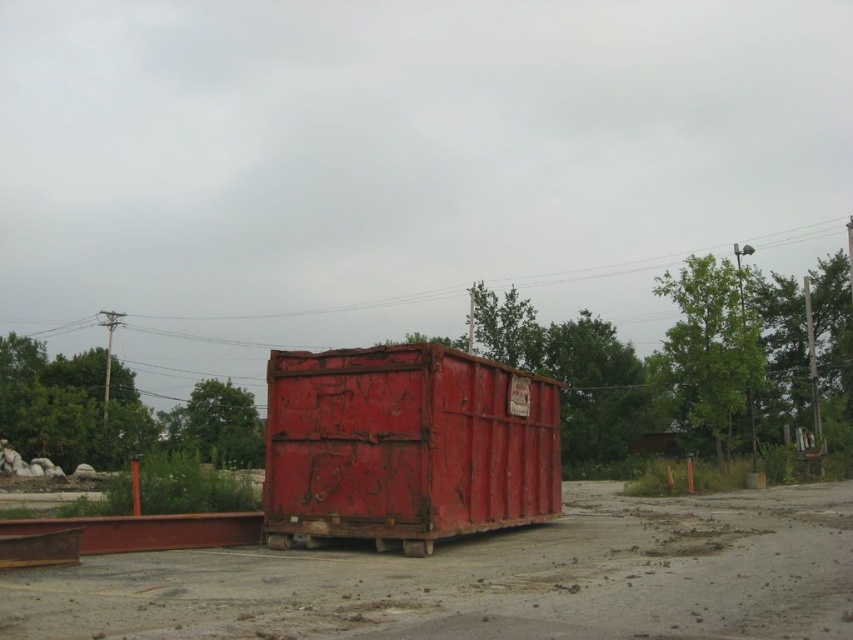
Question: Does dull concrete dirt track at center come in front of rusty metal shipping container at center?

Choices:
 (A) no
 (B) yes

Answer: (B)

Question: Does dull concrete dirt track at center have a greater width compared to rusty metal shipping container at center?

Choices:
 (A) yes
 (B) no

Answer: (A)

Question: Which object appears farthest from the camera in this image?

Choices:
 (A) dull concrete dirt track at center
 (B) rusty metal shipping container at center

Answer: (B)

Question: Which point is farther to the camera?

Choices:
 (A) dull concrete dirt track at center
 (B) rusty metal shipping container at center

Answer: (B)

Question: Where is dull concrete dirt track at center located in relation to rusty metal shipping container at center in the image?

Choices:
 (A) below
 (B) above

Answer: (A)

Question: Which object appears closest to the camera in this image?

Choices:
 (A) rusty metal shipping container at center
 (B) dull concrete dirt track at center

Answer: (B)